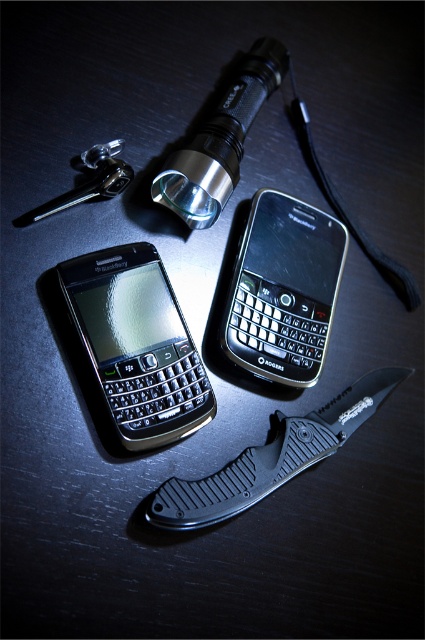
Question: Which of the following is the closest to the observer?

Choices:
 (A) black matte/black textured phone at center
 (B) black matte/black textured phone at center-left
 (C) black textured knife at lower center

Answer: (C)

Question: Considering the real-world distances, which object is closest to the black textured knife at lower center?

Choices:
 (A) black matte/black textured phone at center-left
 (B) black matte/black textured phone at center

Answer: (B)

Question: Considering the real-world distances, which object is farthest from the black matte/black textured phone at center?

Choices:
 (A) black textured knife at lower center
 (B) black matte/black textured phone at center-left

Answer: (A)

Question: Does black matte/black textured phone at center appear on the left side of black textured knife at lower center?

Choices:
 (A) no
 (B) yes

Answer: (A)

Question: Can you confirm if black matte/black textured phone at center is positioned above black textured knife at lower center?

Choices:
 (A) no
 (B) yes

Answer: (B)

Question: In this image, where is black matte/black textured phone at center-left located relative to black textured knife at lower center?

Choices:
 (A) above
 (B) below

Answer: (A)